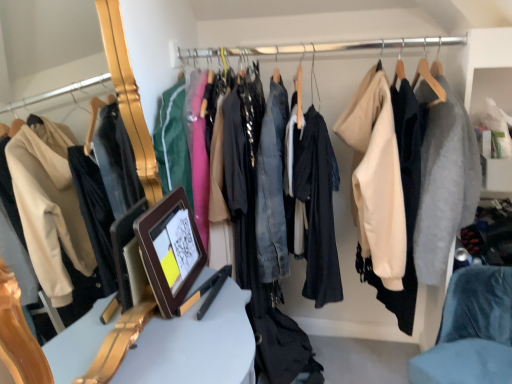
At what (x,y) coordinates should I click in order to perform the action: click on empty space that is ontop of white glossy table at center. Please return your answer as a coordinate pair (x, y). This screenshot has width=512, height=384. Looking at the image, I should click on (192, 320).